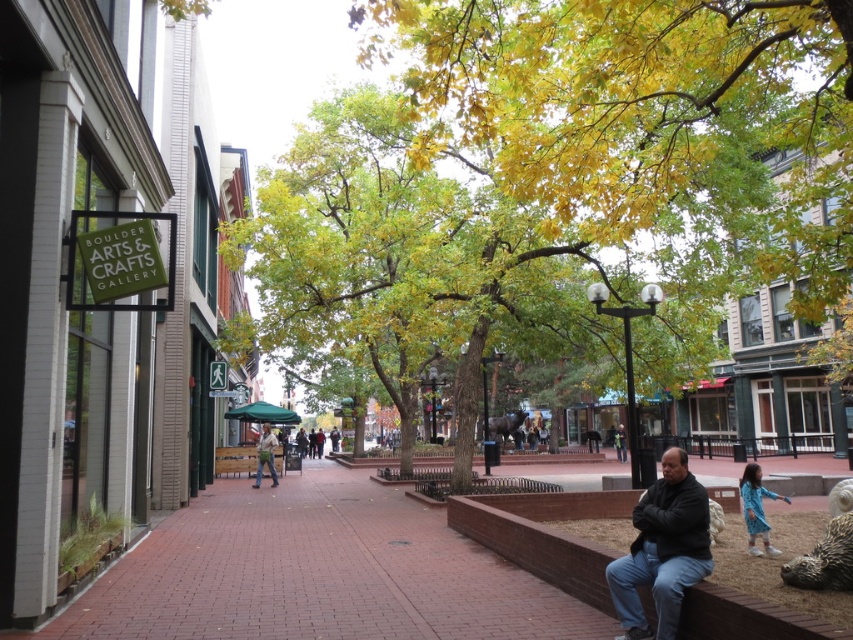
Question: Does blue cotton dress at lower right have a greater width compared to khaki cotton shirt at center?

Choices:
 (A) no
 (B) yes

Answer: (A)

Question: Which point is closer to the camera?

Choices:
 (A) dark gray jacket at lower right
 (B) green leafy tree at center
 (C) blue cotton dress at lower right
 (D) brick ledge at lower right

Answer: (D)

Question: Which point is closer to the camera?

Choices:
 (A) (450, 520)
 (B) (741, 484)

Answer: (B)

Question: Can you confirm if brick ledge at lower right is positioned to the right of blue cotton dress at lower right?

Choices:
 (A) yes
 (B) no

Answer: (B)

Question: Can you confirm if brick ledge at lower right is smaller than dark gray jacket at lower right?

Choices:
 (A) yes
 (B) no

Answer: (B)

Question: Which point is farther from the camera taking this photo?

Choices:
 (A) (553, 276)
 (B) (527, 566)
 (C) (751, 522)
 (D) (659, 604)

Answer: (A)